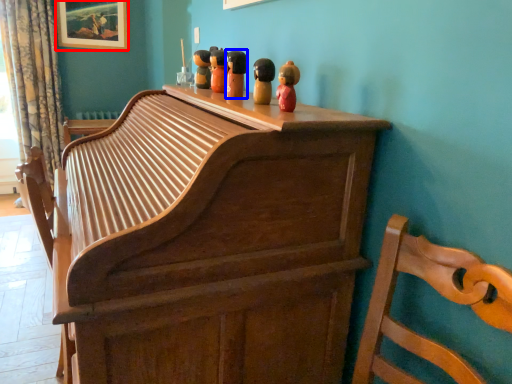
Question: Which object appears farthest to the camera in this image, picture frame (highlighted by a red box) or toy (highlighted by a blue box)?

Choices:
 (A) picture frame
 (B) toy

Answer: (A)